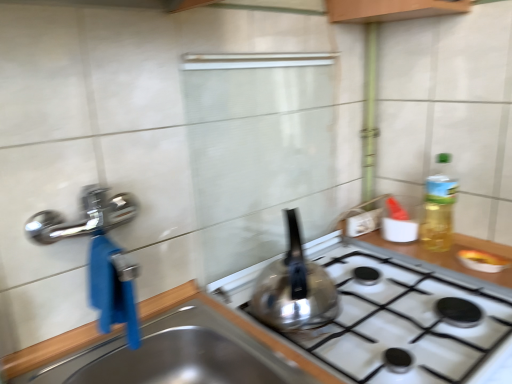
Question: Is stainless steel sink at lower left positioned with its back to satin silver kettle at center?

Choices:
 (A) no
 (B) yes

Answer: (A)

Question: From the image's perspective, is stainless steel sink at lower left on satin silver kettle at center?

Choices:
 (A) yes
 (B) no

Answer: (B)

Question: From a real-world perspective, is stainless steel sink at lower left on satin silver kettle at center?

Choices:
 (A) yes
 (B) no

Answer: (B)

Question: Can you confirm if stainless steel sink at lower left is smaller than satin silver kettle at center?

Choices:
 (A) no
 (B) yes

Answer: (A)

Question: Is satin silver kettle at center completely or partially inside stainless steel sink at lower left?

Choices:
 (A) no
 (B) yes

Answer: (A)

Question: Does stainless steel sink at lower left come behind satin silver kettle at center?

Choices:
 (A) yes
 (B) no

Answer: (B)

Question: Can you confirm if satin silver kettle at center is positioned to the left of stainless steel sink at lower left?

Choices:
 (A) yes
 (B) no

Answer: (B)

Question: Is satin silver kettle at center positioned far away from stainless steel sink at lower left?

Choices:
 (A) no
 (B) yes

Answer: (A)

Question: Can you confirm if satin silver kettle at center is positioned to the right of stainless steel sink at lower left?

Choices:
 (A) no
 (B) yes

Answer: (B)

Question: From the image's perspective, is satin silver kettle at center on stainless steel sink at lower left?

Choices:
 (A) yes
 (B) no

Answer: (A)

Question: From the image's perspective, is satin silver kettle at center below stainless steel sink at lower left?

Choices:
 (A) no
 (B) yes

Answer: (A)

Question: Is satin silver kettle at center located outside stainless steel sink at lower left?

Choices:
 (A) yes
 (B) no

Answer: (A)

Question: Considering the positions of satin silver kettle at center and stainless steel sink at lower left in the image, is satin silver kettle at center taller or shorter than stainless steel sink at lower left?

Choices:
 (A) short
 (B) tall

Answer: (B)